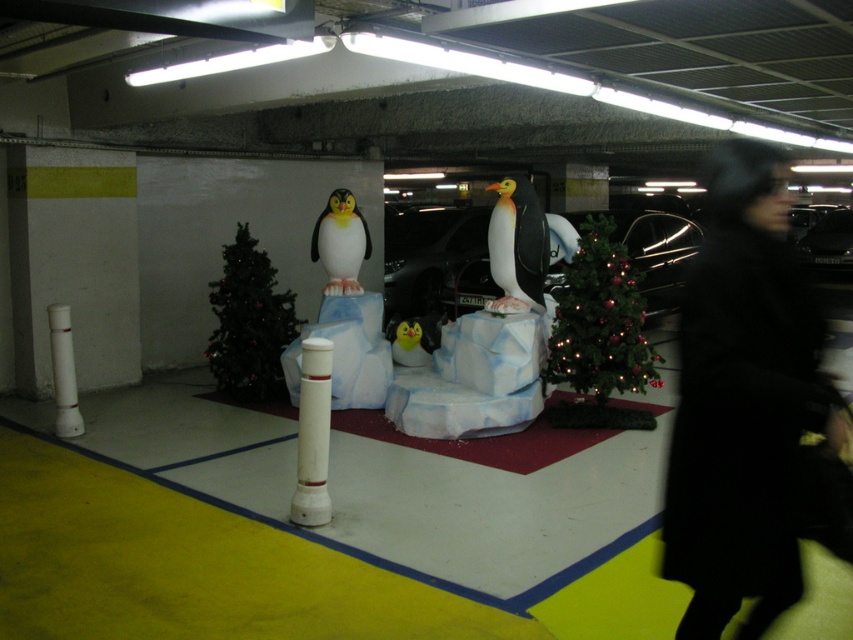
This screenshot has height=640, width=853. I want to click on black matte coat at lower right, so click(743, 401).

Does point (752, 390) come behind point (54, 420)?

No.

You are a GUI agent. You are given a task and a screenshot of the screen. Output one action in this format:
    pyautogui.click(x=<x>, y=<y>)
    Task: Click on the black matte coat at lower right
    The height and width of the screenshot is (640, 853).
    Given the screenshot: What is the action you would take?
    pyautogui.click(x=743, y=401)

Who is positioned more to the right, black matte coat at lower right or white plastic pole at center?

Positioned to the right is black matte coat at lower right.

Is black matte coat at lower right further to camera compared to white plastic pole at center?

That is False.

The height and width of the screenshot is (640, 853). What do you see at coordinates (743, 401) in the screenshot?
I see `black matte coat at lower right` at bounding box center [743, 401].

Find the location of a particular element. black matte coat at lower right is located at coordinates (743, 401).

Is white matte penguin at center behind yellow matte penguin at center?

No.

Who is shorter, white matte penguin at center or yellow matte penguin at center?

yellow matte penguin at center

The height and width of the screenshot is (640, 853). Identify the location of white matte penguin at center. (517, 246).